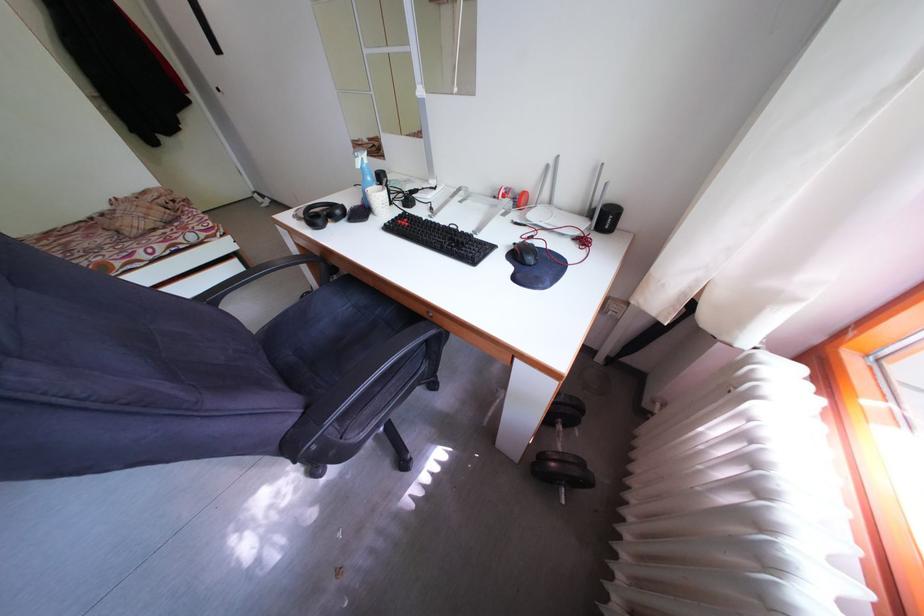
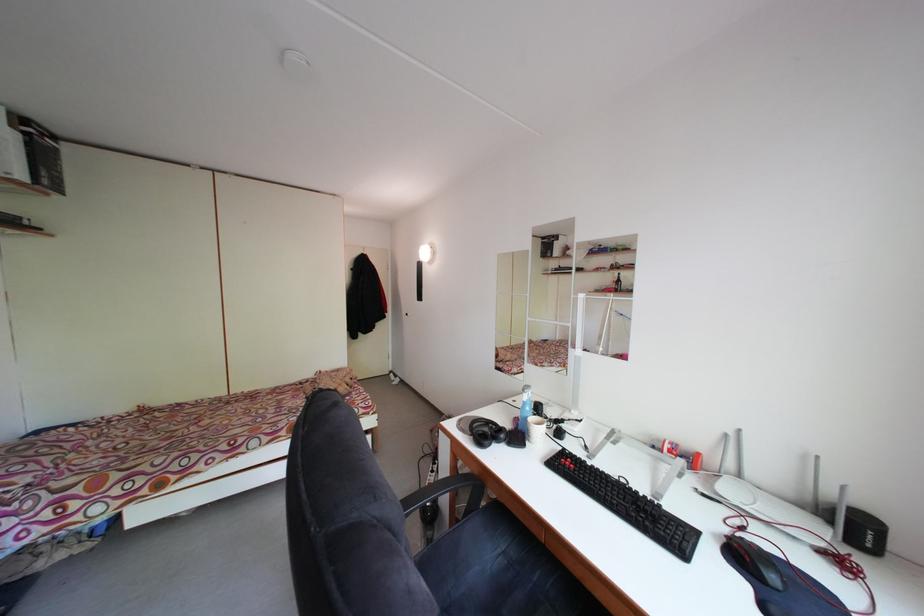
Locate, in the second image, the point that corresponds to the point at 555,172 in the first image.

(735, 442)